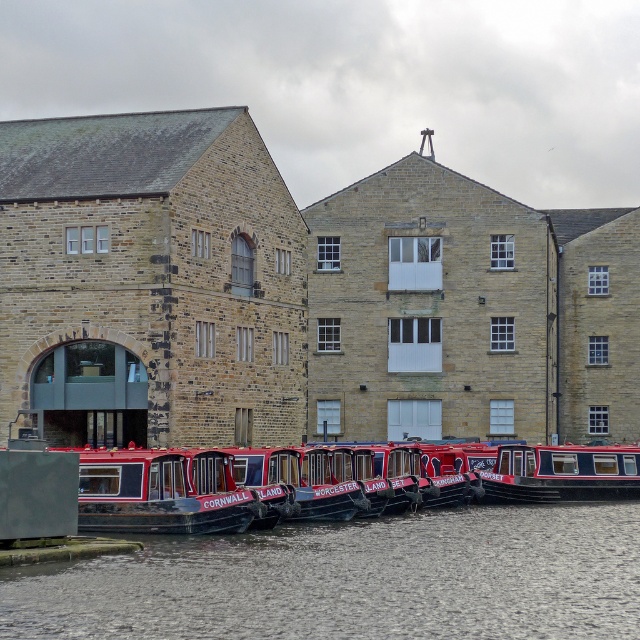
You are a tourist standing on the cobblestone riverbank and want to take a photo of both the metallic red canal boat at center and the red polished wood boat at center. Which boat should you focus on first to ensure both are in the frame?

You should focus on the metallic red canal boat at center first because it is closer to you than the red polished wood boat at center, so by focusing on it, the red polished wood boat at center will also be in the frame.

You are standing on the riverside path and want to take a photo of the red polished wood boat at center. To ensure the smooth gray water at lower center is in the foreground of your photo, should you position yourself closer to or farther from the boat?

To have the smooth gray water at lower center in the foreground, you should position yourself closer to the boat since the water is closer to the viewer than the red polished wood boat at center.

You are a photographer planning to capture the reflection of the metallic red canal boat at center in the smooth gray water at lower center. Given their sizes, will the reflection of the boat be entirely visible within the water area?

The smooth gray water at lower center has a larger size compared to metallic red canal boat at center, so the reflection of the metallic red canal boat at center will be entirely visible within the water area.